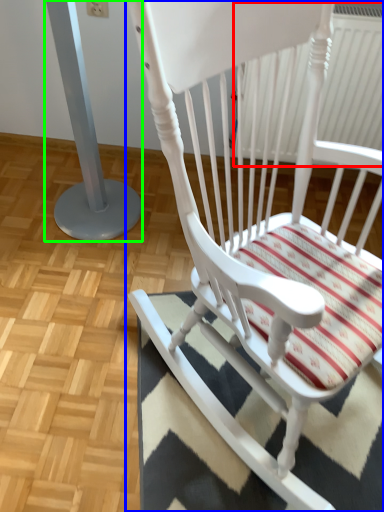
Question: Which object is positioned closest to radiator (highlighted by a red box)? Select from chair (highlighted by a blue box) and pillar (highlighted by a green box).

Choices:
 (A) chair
 (B) pillar

Answer: (A)